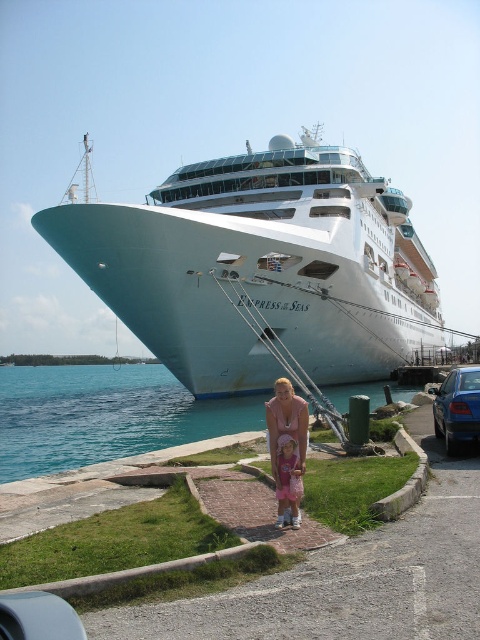
Which is more to the right, matte pink dress at center or pink fabric dress at center?

pink fabric dress at center is more to the right.

Who is more forward, (275, 429) or (277, 484)?

Positioned in front is point (277, 484).

Where is `matte pink dress at center`? matte pink dress at center is located at coordinates (287, 422).

Which is below, white glossy cruise ship at center or blue water at lower left?

blue water at lower left

Is point (316, 160) farther from viewer compared to point (240, 413)?

Yes.

Which is behind, point (405, 266) or point (160, 435)?

The point (405, 266) is more distant.

Locate an element on the screen. The image size is (480, 640). white glossy cruise ship at center is located at coordinates (261, 268).

Consider the image. Is the position of blue metallic car at lower right more distant than that of matte pink dress at center?

Yes, it is.

Does blue metallic car at lower right have a lesser width compared to matte pink dress at center?

No.

Does point (439, 424) lie in front of point (267, 435)?

That is False.

Where is `blue metallic car at lower right`? blue metallic car at lower right is located at coordinates (456, 406).